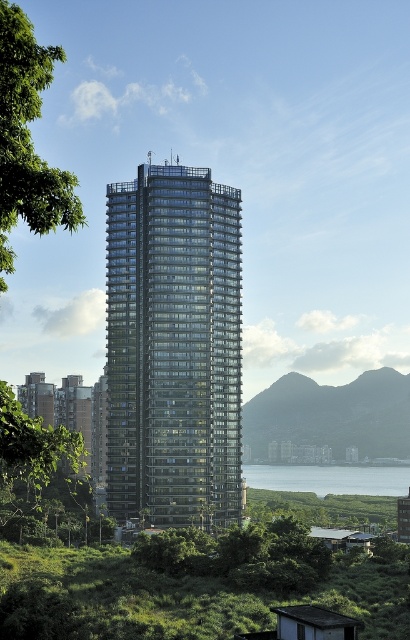
Does green leafy tree at upper left have a lesser width compared to rocky gray hillside at center?

Correct, green leafy tree at upper left's width is less than rocky gray hillside at center's.

Is green leafy tree at upper left wider than rocky gray hillside at center?

Incorrect, green leafy tree at upper left's width does not surpass rocky gray hillside at center's.

Is point (31, 205) farther from viewer compared to point (398, 408)?

No, (31, 205) is in front of (398, 408).

You are a GUI agent. You are given a task and a screenshot of the screen. Output one action in this format:
    pyautogui.click(x=<x>, y=<y>)
    Task: Click on the green leafy tree at upper left
    
    Given the screenshot: What is the action you would take?
    pyautogui.click(x=27, y=138)

Does point (202, 413) come in front of point (296, 484)?

That is True.

Who is taller, transparent glass building at center or blue glass water at lower center?

transparent glass building at center

Locate an element on the screen. This screenshot has width=410, height=640. transparent glass building at center is located at coordinates (173, 348).

Is transparent glass building at center further to camera compared to rocky gray hillside at center?

No, transparent glass building at center is closer to the viewer.

Looking at this image, is transparent glass building at center wider than rocky gray hillside at center?

No, transparent glass building at center is not wider than rocky gray hillside at center.

Does point (220, 394) lie behind point (375, 449)?

No.

Image resolution: width=410 pixels, height=640 pixels. What are the coordinates of `transparent glass building at center` in the screenshot? It's located at [x=173, y=348].